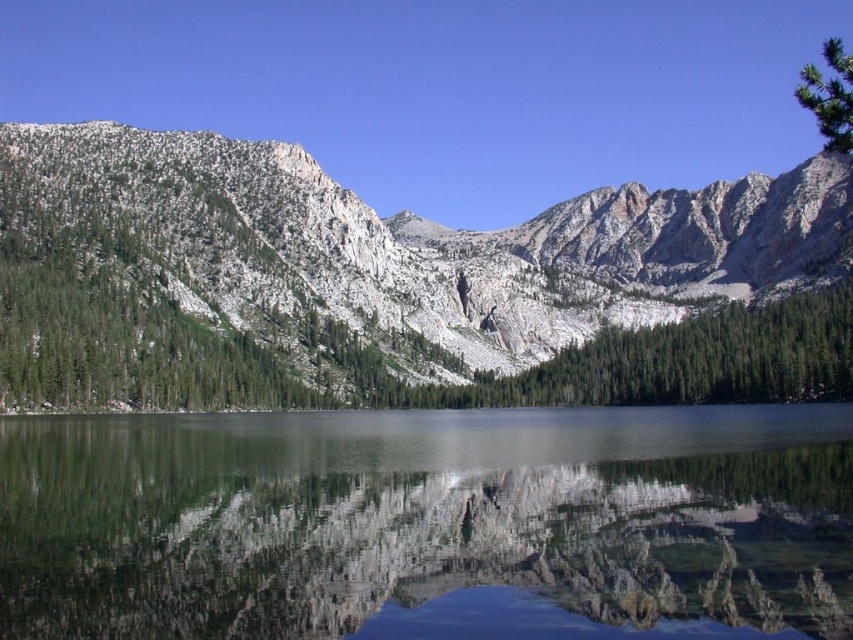
Can you confirm if green textured mountain at center is wider than clear glass water at center?

Yes, green textured mountain at center is wider than clear glass water at center.

Does green textured mountain at center lie in front of clear glass water at center?

No, green textured mountain at center is further to the viewer.

Locate an element on the screen. This screenshot has width=853, height=640. green textured mountain at center is located at coordinates (399, 285).

Locate an element on the screen. green textured mountain at center is located at coordinates (399, 285).